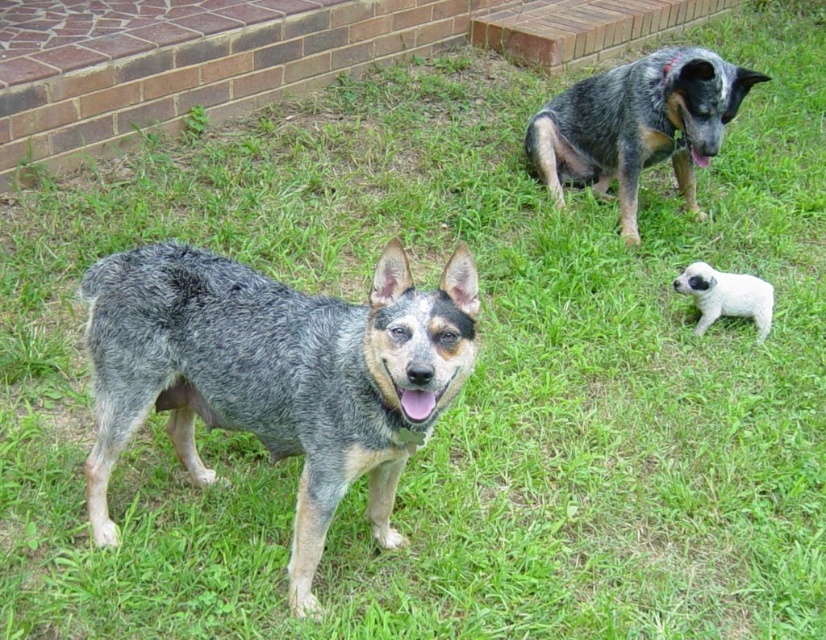
Question: Does speckled fur dog at center have a greater width compared to speckled fur dog at upper right?

Choices:
 (A) no
 (B) yes

Answer: (B)

Question: Which object is closer to the camera taking this photo?

Choices:
 (A) speckled fur dog at center
 (B) speckled fur dog at upper right

Answer: (A)

Question: Is speckled fur dog at center positioned at the back of white fluffy puppy at lower right?

Choices:
 (A) no
 (B) yes

Answer: (A)

Question: Is speckled fur dog at center closer to camera compared to white fluffy puppy at lower right?

Choices:
 (A) yes
 (B) no

Answer: (A)

Question: Which of the following is the farthest from the observer?

Choices:
 (A) (689, 280)
 (B) (589, 177)
 (C) (198, 301)

Answer: (B)

Question: Which of the following is the closest to the observer?

Choices:
 (A) (120, 321)
 (B) (629, 132)

Answer: (A)